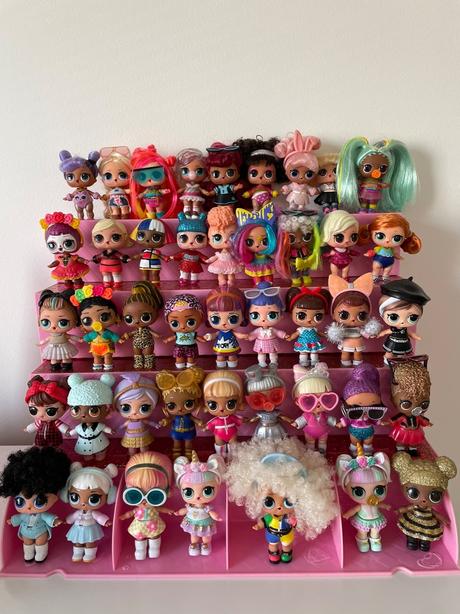
What are the coordinates of `dolls on the middle row` in the screenshot? It's located at (393, 312), (348, 314), (308, 311), (266, 309), (222, 309), (183, 315), (140, 309), (92, 317), (49, 321).